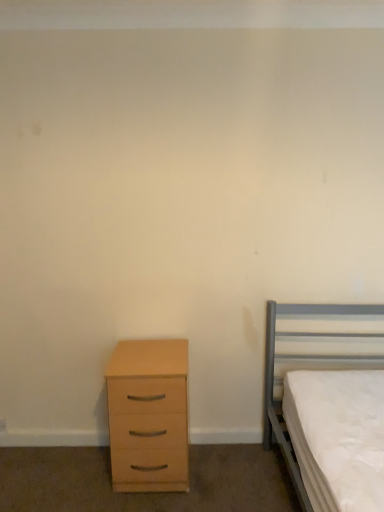
At what (x,y) coordinates should I click in order to perform the action: click on blank space situated above light wood/veneer chest of drawers at lower left (from a real-world perspective). Please return your answer as a coordinate pair (x, y). This screenshot has height=512, width=384. Looking at the image, I should click on (150, 347).